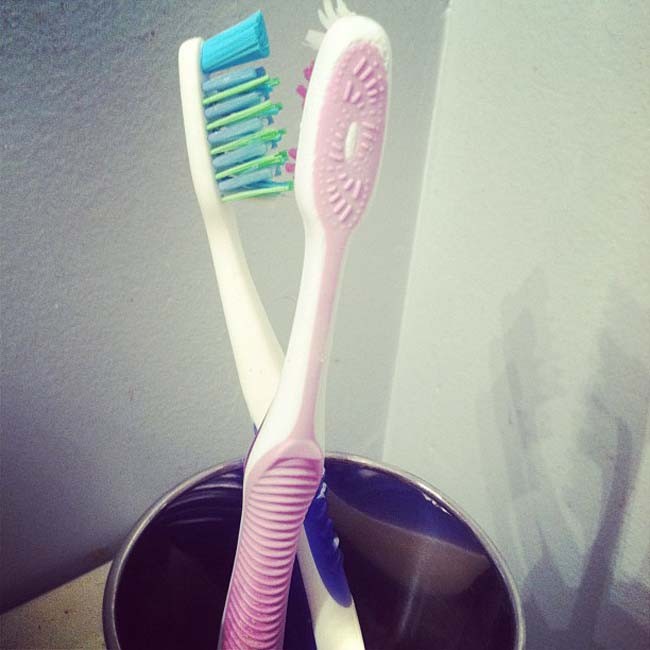
Where is `blue and white toothbrush`? The image size is (650, 650). blue and white toothbrush is located at coordinates (237, 124), (335, 547).